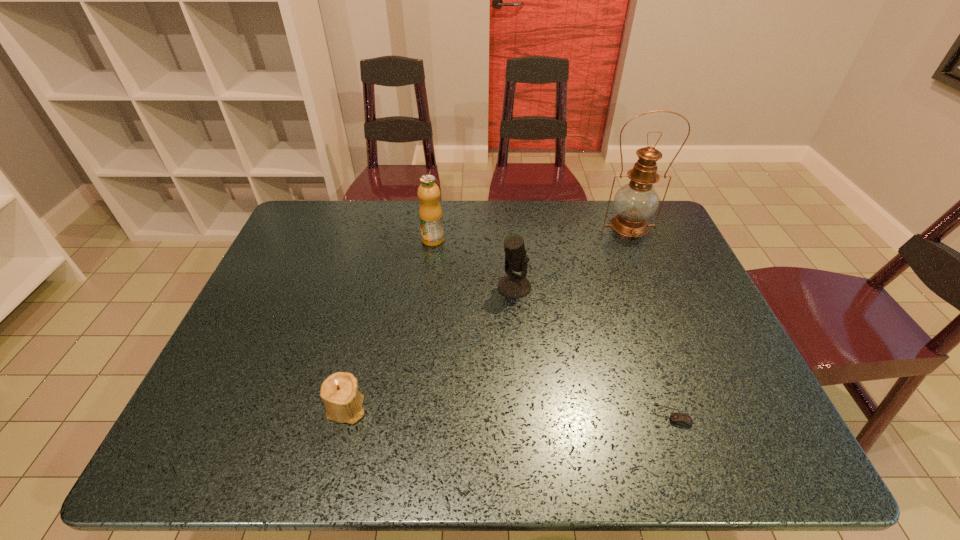
Where is `free point between the microphone and the candle_holder`? Image resolution: width=960 pixels, height=540 pixels. free point between the microphone and the candle_holder is located at coordinates (430, 347).

The height and width of the screenshot is (540, 960). I want to click on free space that is in between the candle_holder and the shortest object, so click(x=509, y=411).

I want to click on vacant region between the third object from right to left and the leftmost object, so click(430, 347).

Find the location of a particular element. This screenshot has width=960, height=540. object that is the third closest one to the shortest object is located at coordinates (343, 402).

Locate an element on the screen. The width and height of the screenshot is (960, 540). the fourth closest object to the third object from right to left is located at coordinates (343, 402).

At what (x,y) coordinates should I click in order to perform the action: click on blank space that satisfies the following two spatial constraints: 1. on the front label of the third object from right to left; 2. on the right side of the fruit juice. Please return your answer as a coordinate pair (x, y). This screenshot has width=960, height=540. Looking at the image, I should click on (427, 287).